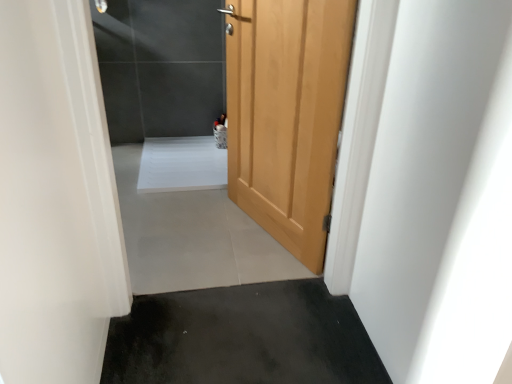
Locate an element on the screen. black rubber mat at lower center, acting as the 2th concrete starting from the back is located at coordinates (242, 337).

Describe the element at coordinates (286, 114) in the screenshot. I see `wooden door at center` at that location.

Locate an element on the screen. black rubber mat at lower center, the 1th concrete positioned from the bottom is located at coordinates (242, 337).

From the image's perspective, relative to black rubber mat at lower center, acting as the 2th concrete starting from the back, is wooden door at center above or below?

Clearly, from the image's perspective, wooden door at center is above black rubber mat at lower center, acting as the 2th concrete starting from the back.

From a real-world perspective, is wooden door at center under black rubber mat at lower center, acting as the second concrete starting from the top?

No, from a real-world perspective, wooden door at center is not beneath black rubber mat at lower center, acting as the second concrete starting from the top.

Could you tell me if wooden door at center is turned towards black rubber mat at lower center, the first concrete positioned from the front?

Yes, wooden door at center is oriented towards black rubber mat at lower center, the first concrete positioned from the front.

Is wooden door at center spatially inside black rubber mat at lower center, acting as the second concrete starting from the top, or outside of it?

wooden door at center is not inside black rubber mat at lower center, acting as the second concrete starting from the top, it's outside.

Does wooden door at center appear on the left side of gray tile floor at center, which is the 1th concrete from top to bottom?

In fact, wooden door at center is to the right of gray tile floor at center, which is the 1th concrete from top to bottom.

I want to click on door above the gray tile floor at center, the 1th concrete when ordered from back to front (from the image's perspective), so point(286,114).

Which object is thinner, wooden door at center or gray tile floor at center, which appears as the 2th concrete when ordered from the bottom?

With smaller width is wooden door at center.

What's the angular difference between wooden door at center and gray tile floor at center, the 1th concrete when ordered from back to front,'s facing directions?

The angle between the facing direction of wooden door at center and the facing direction of gray tile floor at center, the 1th concrete when ordered from back to front, is 67.2 degrees.

Can you confirm if black rubber mat at lower center, acting as the 2th concrete starting from the back, is taller than wooden door at center?

No.

Is black rubber mat at lower center, the 1th concrete positioned from the bottom, to the left or to the right of wooden door at center in the image?

black rubber mat at lower center, the 1th concrete positioned from the bottom, is to the right of wooden door at center.

Is black rubber mat at lower center, the first concrete positioned from the front, bigger than wooden door at center?

No, black rubber mat at lower center, the first concrete positioned from the front, is not bigger than wooden door at center.

Does point (298, 360) come behind point (298, 10)?

No.

Who is taller, black rubber mat at lower center, the first concrete positioned from the front, or wooden door at center?

wooden door at center is taller.

How many degrees apart are the facing directions of black rubber mat at lower center, acting as the 2th concrete starting from the back, and wooden door at center?

The angle between the facing direction of black rubber mat at lower center, acting as the 2th concrete starting from the back, and the facing direction of wooden door at center is 157 degrees.

Is black rubber mat at lower center, the 1th concrete positioned from the bottom, in front of or behind wooden door at center in the image?

Clearly, black rubber mat at lower center, the 1th concrete positioned from the bottom, is in front of wooden door at center.

From the image's perspective, is black rubber mat at lower center, the 1th concrete positioned from the bottom, above or below wooden door at center?

black rubber mat at lower center, the 1th concrete positioned from the bottom, is below wooden door at center.

Is the position of wooden door at center more distant than that of wooden door at center?

That is True.

In the scene shown: From the image's perspective, which one is positioned higher, wooden door at center or wooden door at center?

wooden door at center appears higher in the image.

Is wooden door at center at the back of wooden door at center?

That's not correct — wooden door at center is not looking away from wooden door at center.

Looking at this image, how different are the orientations of wooden door at center and wooden door at center in degrees?

They differ by 67.5 degrees in their facing directions.

Who is smaller, gray tile floor at center, which appears as the 2th concrete when ordered from the bottom, or wooden door at center?

gray tile floor at center, which appears as the 2th concrete when ordered from the bottom, is smaller.

Which object is positioned more to the right, gray tile floor at center, which appears as the 2th concrete when ordered from the bottom, or wooden door at center?

wooden door at center.

Is gray tile floor at center, the 1th concrete when ordered from back to front, oriented towards wooden door at center?

No.

From the image's perspective, which one is positioned lower, gray tile floor at center, which is the 1th concrete from top to bottom, or wooden door at center?

gray tile floor at center, which is the 1th concrete from top to bottom, is shown below in the image.

From the image's perspective, which one is positioned higher, gray tile floor at center, arranged as the second concrete when viewed from the front, or black rubber mat at lower center, acting as the second concrete starting from the top?

From the image's view, gray tile floor at center, arranged as the second concrete when viewed from the front, is above.

Is gray tile floor at center, which appears as the 2th concrete when ordered from the bottom, far from black rubber mat at lower center, acting as the second concrete starting from the top?

No, there isn't a large distance between gray tile floor at center, which appears as the 2th concrete when ordered from the bottom, and black rubber mat at lower center, acting as the second concrete starting from the top.

Measure the distance from gray tile floor at center, which is the 1th concrete from top to bottom, to black rubber mat at lower center, the first concrete positioned from the front.

gray tile floor at center, which is the 1th concrete from top to bottom, and black rubber mat at lower center, the first concrete positioned from the front, are 17.86 inches apart.

Is the depth of gray tile floor at center, which is the 1th concrete from top to bottom, less than that of black rubber mat at lower center, the 1th concrete positioned from the bottom?

No, the depth of gray tile floor at center, which is the 1th concrete from top to bottom, is greater than that of black rubber mat at lower center, the 1th concrete positioned from the bottom.

Image resolution: width=512 pixels, height=384 pixels. Find the location of `door on the right of black rubber mat at lower center, the 1th concrete positioned from the bottom`. door on the right of black rubber mat at lower center, the 1th concrete positioned from the bottom is located at coordinates (286, 114).

At what (x,y) coordinates should I click in order to perform the action: click on the 1st concrete positioned below the wooden door at center (from a real-world perspective). Please return your answer as a coordinate pair (x, y). Looking at the image, I should click on (192, 237).

Which object lies further to the anchor point gray tile floor at center, which is the 1th concrete from top to bottom, black rubber mat at lower center, the 1th concrete positioned from the bottom, or wooden door at center?

wooden door at center is further to gray tile floor at center, which is the 1th concrete from top to bottom.

When comparing their distances from black rubber mat at lower center, acting as the second concrete starting from the top, does wooden door at center or wooden door at center seem further?

wooden door at center is further to black rubber mat at lower center, acting as the second concrete starting from the top.

Based on their spatial positions, is wooden door at center or gray tile floor at center, which is the 1th concrete from top to bottom, further from wooden door at center?

Based on the image, wooden door at center appears to be further to wooden door at center.

From the image, which object appears to be farther from gray tile floor at center, which is the 1th concrete from top to bottom, wooden door at center or wooden door at center?

Among the two, wooden door at center is located further to gray tile floor at center, which is the 1th concrete from top to bottom.

When comparing their distances from black rubber mat at lower center, acting as the second concrete starting from the top, does wooden door at center or wooden door at center seem further?

wooden door at center lies further to black rubber mat at lower center, acting as the second concrete starting from the top, than the other object.

Estimate the real-world distances between objects in this image. Which object is further from wooden door at center, gray tile floor at center, which appears as the 2th concrete when ordered from the bottom, or black rubber mat at lower center, acting as the second concrete starting from the top?

black rubber mat at lower center, acting as the second concrete starting from the top.

Looking at the image, which one is located further to black rubber mat at lower center, acting as the second concrete starting from the top, gray tile floor at center, the 1th concrete when ordered from back to front, or wooden door at center?

The object further to black rubber mat at lower center, acting as the second concrete starting from the top, is wooden door at center.

Based on their spatial positions, is wooden door at center or gray tile floor at center, which appears as the 2th concrete when ordered from the bottom, further from black rubber mat at lower center, acting as the second concrete starting from the top?

Based on the image, wooden door at center appears to be further to black rubber mat at lower center, acting as the second concrete starting from the top.

This screenshot has width=512, height=384. Find the location of `concrete between wooden door at center and black rubber mat at lower center, acting as the 2th concrete starting from the back, vertically`. concrete between wooden door at center and black rubber mat at lower center, acting as the 2th concrete starting from the back, vertically is located at coordinates (192, 237).

The height and width of the screenshot is (384, 512). Find the location of `concrete between wooden door at center and black rubber mat at lower center, acting as the 2th concrete starting from the back, vertically`. concrete between wooden door at center and black rubber mat at lower center, acting as the 2th concrete starting from the back, vertically is located at coordinates (192, 237).

Identify the location of door located between wooden door at center and gray tile floor at center, arranged as the second concrete when viewed from the front, in the depth direction. This screenshot has width=512, height=384. (286, 114).

Identify the location of screen door that lies between wooden door at center and black rubber mat at lower center, the 1th concrete positioned from the bottom, from top to bottom. The image size is (512, 384). (297, 112).